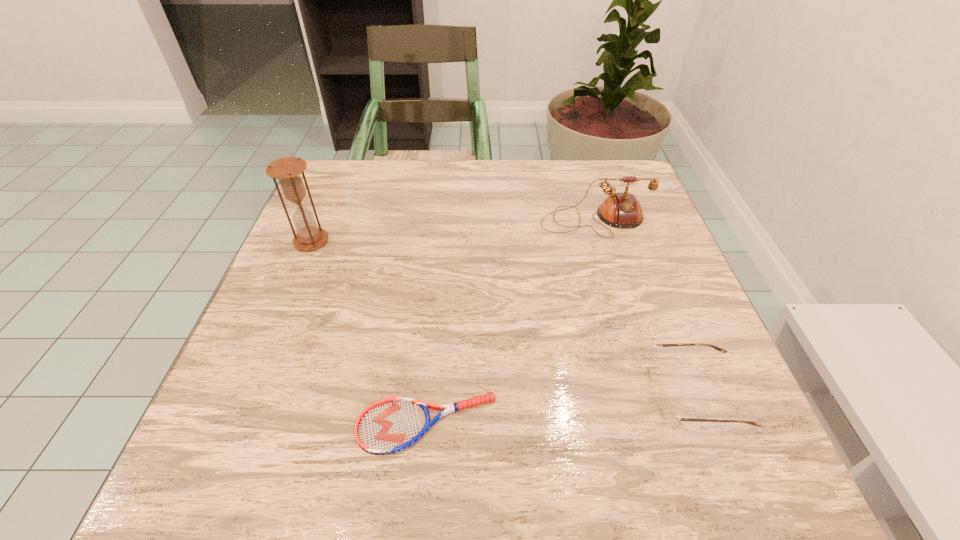
The image size is (960, 540). I want to click on vacant space located on the front-facing side of the spectacles, so click(x=454, y=393).

The image size is (960, 540). I want to click on free region located on the left of the third object from right to left, so click(x=311, y=424).

The image size is (960, 540). I want to click on object positioned at the far edge, so click(x=619, y=210).

Where is `object that is at the near edge`? object that is at the near edge is located at coordinates click(x=390, y=425).

Where is `object that is positioned at the left edge`? The width and height of the screenshot is (960, 540). object that is positioned at the left edge is located at coordinates (287, 170).

Locate an element on the screen. This screenshot has width=960, height=540. telephone that is at the right edge is located at coordinates (619, 210).

Find the location of `spectacles that is at the right edge`. spectacles that is at the right edge is located at coordinates (666, 408).

Identify the location of object at the far right corner. (619, 210).

In order to click on vacant space at the far edge in this screenshot , I will do `click(407, 199)`.

This screenshot has height=540, width=960. I want to click on vacant space at the near edge of the desktop, so click(584, 472).